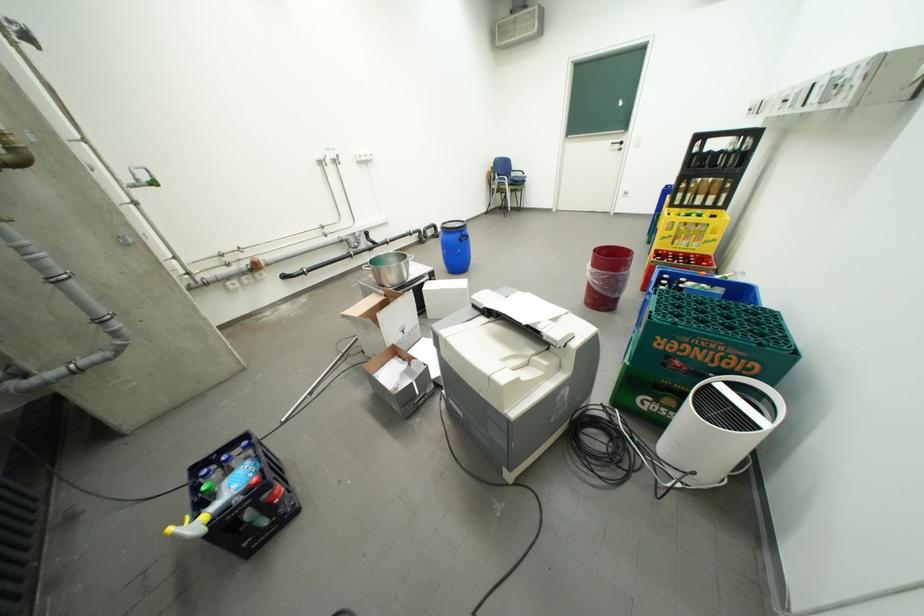
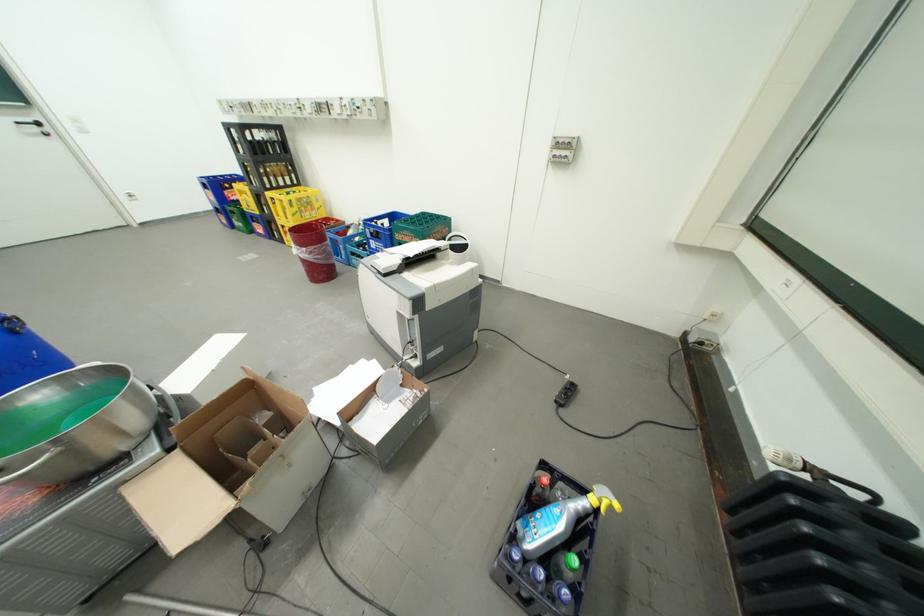
In the second image, find the point that corresponds to (x=629, y=142) in the first image.

(41, 122)